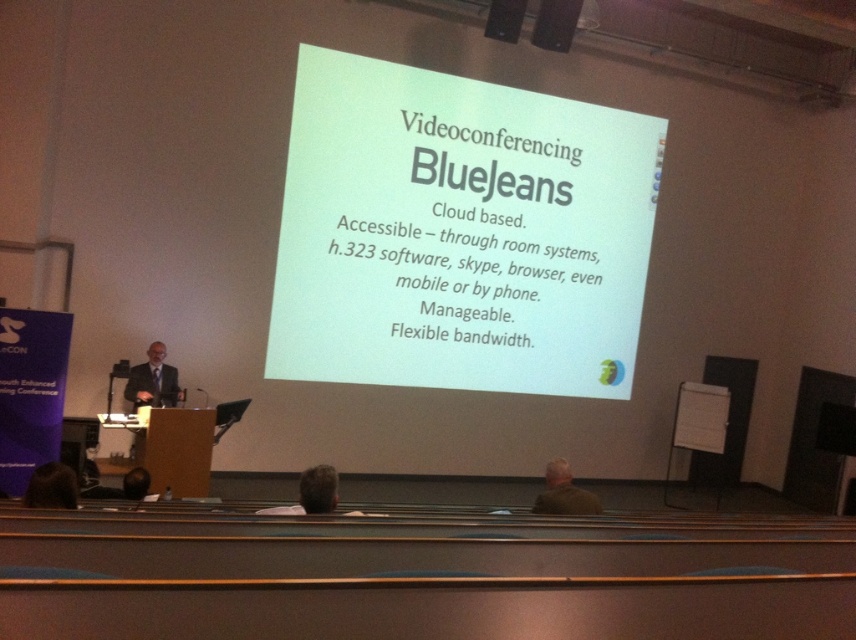
Question: Which of the following is the closest to the observer?

Choices:
 (A) brown fabric jacket at lower center
 (B) dark gray suit at left
 (C) white paper at center
 (D) dark brown hair at lower left

Answer: (D)

Question: Is dark gray suit at left to the right of gray hair at center from the viewer's perspective?

Choices:
 (A) yes
 (B) no

Answer: (B)

Question: Can you confirm if brown fabric jacket at lower center is positioned below dark brown hair at lower left?

Choices:
 (A) no
 (B) yes

Answer: (B)

Question: Based on their relative distances, which object is farther from the white paper at center?

Choices:
 (A) gray hair at center
 (B) dark gray suit at left

Answer: (A)

Question: Which is farther from the gray hair at center?

Choices:
 (A) white paper at center
 (B) brown fabric jacket at lower center
 (C) dark brown hair at lower left
 (D) dark gray suit at left

Answer: (A)

Question: Can you confirm if dark gray suit at left is positioned below brown fabric jacket at lower center?

Choices:
 (A) yes
 (B) no

Answer: (B)